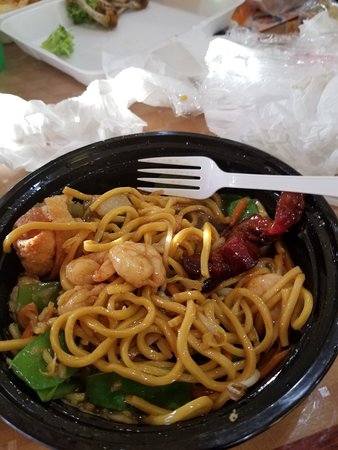
I want to click on tray, so click(87, 51).